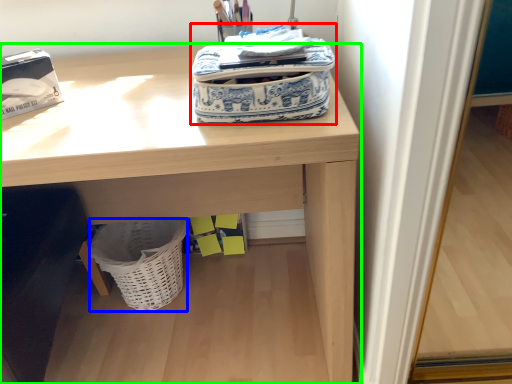
Question: Which object is the closest to the bag (highlighted by a red box)? Choose among these: basket (highlighted by a blue box) or desk (highlighted by a green box).

Choices:
 (A) basket
 (B) desk

Answer: (B)